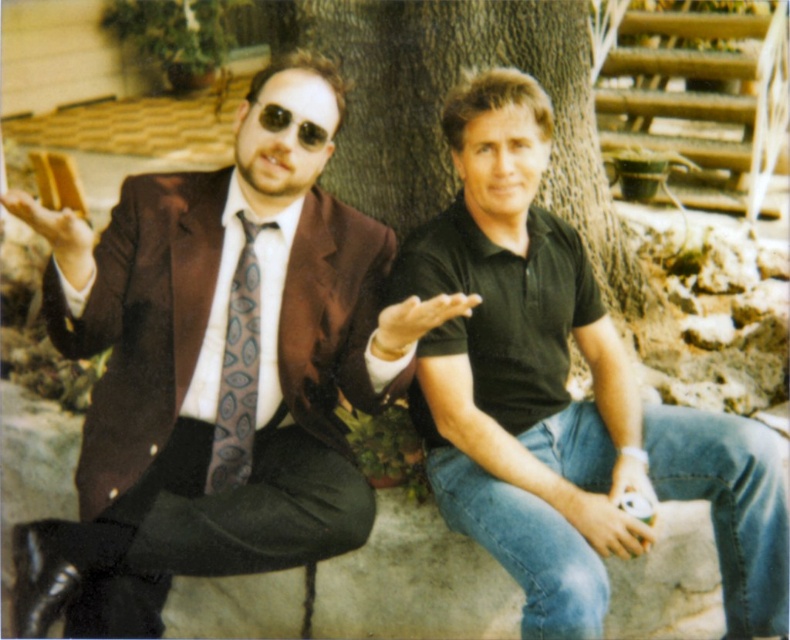
Who is shorter, black matte shirt at center or matte gray tie at left?

matte gray tie at left is shorter.

Between point (540, 451) and point (251, 240), which one is positioned in front?

Positioned in front is point (251, 240).

Does point (655, 413) come closer to viewer compared to point (273, 364)?

No, it is behind (273, 364).

Find the location of a particular element. The width and height of the screenshot is (790, 640). black matte shirt at center is located at coordinates (562, 396).

Is point (562, 536) closer to viewer compared to point (243, 244)?

Yes, it is in front of point (243, 244).

Does jeans at lower right have a larger size compared to matte gray tie at left?

Correct, jeans at lower right is larger in size than matte gray tie at left.

Is point (721, 440) positioned after point (239, 280)?

No, it is in front of (239, 280).

You are a GUI agent. You are given a task and a screenshot of the screen. Output one action in this format:
    pyautogui.click(x=<x>, y=<y>)
    Task: Click on the jeans at lower right
    The height and width of the screenshot is (640, 790).
    Given the screenshot: What is the action you would take?
    pyautogui.click(x=728, y=506)

Is brown textured tree trunk at center to the right of sunglasses at center from the viewer's perspective?

Yes, brown textured tree trunk at center is to the right of sunglasses at center.

Looking at this image, can you confirm if brown textured tree trunk at center is positioned below sunglasses at center?

Actually, brown textured tree trunk at center is above sunglasses at center.

Which is behind, point (399, 211) or point (264, 128)?

The point (399, 211) is more distant.

The image size is (790, 640). I want to click on brown textured tree trunk at center, so pos(441,104).